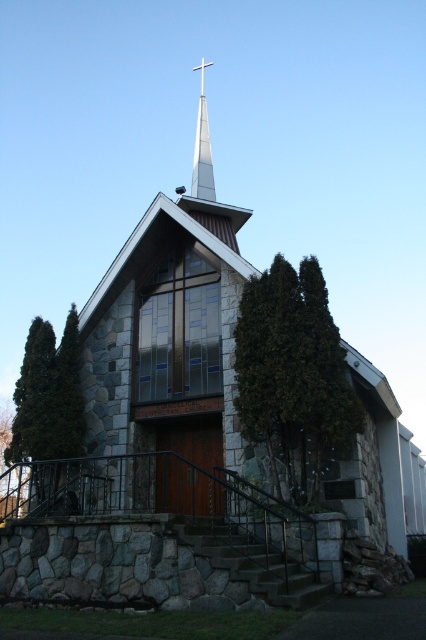
Does green leafy tree at left appear on the left side of silver metallic spire at upper center?

Yes, green leafy tree at left is to the left of silver metallic spire at upper center.

Is green leafy tree at left closer to camera compared to silver metallic spire at upper center?

Yes.

Does point (60, 392) lie behind point (206, 115)?

No, it is not.

Locate an element on the screen. The image size is (426, 640). green leafy tree at left is located at coordinates (48, 396).

How distant is green textured stone at center from silver metallic spire at upper center?

A distance of 31.96 meters exists between green textured stone at center and silver metallic spire at upper center.

In the scene shown: Who is positioned more to the left, green textured stone at center or silver metallic spire at upper center?

From the viewer's perspective, silver metallic spire at upper center appears more on the left side.

Is point (299, 264) behind point (196, 161)?

No, (299, 264) is closer to viewer.

Image resolution: width=426 pixels, height=640 pixels. I want to click on green textured stone at center, so click(293, 374).

Does silver metallic spire at upper center appear on the right side of metallic cross at upper center?

Yes, silver metallic spire at upper center is to the right of metallic cross at upper center.

Does silver metallic spire at upper center appear on the left side of metallic cross at upper center?

No, silver metallic spire at upper center is not to the left of metallic cross at upper center.

In order to click on silver metallic spire at upper center in this screenshot , I will do `click(203, 148)`.